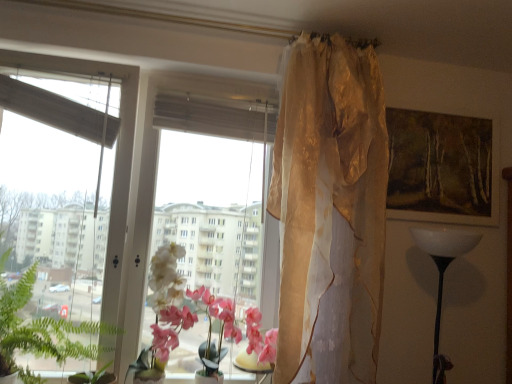
Locate an element on the screen. pink silk orchid at center is located at coordinates (184, 307).

Locate an element on the screen. wooden framed painting at upper right is located at coordinates (440, 168).

Describe the element at coordinates (440, 168) in the screenshot. I see `wooden framed painting at upper right` at that location.

The height and width of the screenshot is (384, 512). What do you see at coordinates (253, 365) in the screenshot? I see `translucent glass table at center` at bounding box center [253, 365].

In order to click on transparent glass window at center in this screenshot , I will do `click(120, 193)`.

Is transparent glass window at center not within translucent glass table at center?

Absolutely, transparent glass window at center is external to translucent glass table at center.

Who is bigger, transparent glass window at center or translucent glass table at center?

transparent glass window at center is bigger.

Which of these two, transparent glass window at center or translucent glass table at center, is wider?

With larger width is translucent glass table at center.

In the image, is transparent glass window at center positioned in front of or behind translucent glass table at center?

Clearly, transparent glass window at center is in front of translucent glass table at center.

Between wooden framed painting at upper right and transparent glass window at center, which one has larger size?

Bigger between the two is transparent glass window at center.

Are wooden framed painting at upper right and transparent glass window at center making contact?

There is a gap between wooden framed painting at upper right and transparent glass window at center.

Does wooden framed painting at upper right turn towards transparent glass window at center?

No, wooden framed painting at upper right does not turn towards transparent glass window at center.

Based on the photo, between wooden framed painting at upper right and transparent glass window at center, which one has larger width?

Wider between the two is transparent glass window at center.

Is translucent glass table at center to the left of translucent gold curtain at upper center from the viewer's perspective?

Yes.

Is translucent glass table at center inside the boundaries of translucent gold curtain at upper center, or outside?

translucent glass table at center exists outside the volume of translucent gold curtain at upper center.

Considering the sizes of objects translucent glass table at center and translucent gold curtain at upper center in the image provided, who is taller, translucent glass table at center or translucent gold curtain at upper center?

Standing taller between the two is translucent gold curtain at upper center.

How different are the orientations of translucent glass table at center and translucent gold curtain at upper center in degrees?

translucent glass table at center and translucent gold curtain at upper center are facing 4.09 degrees away from each other.

From the image's perspective, which is below, wooden framed painting at upper right or green leafy plant at left?

green leafy plant at left is shown below in the image.

Measure the distance from wooden framed painting at upper right to green leafy plant at left.

1.66 meters.

Does wooden framed painting at upper right appear on the right side of green leafy plant at left?

Yes, wooden framed painting at upper right is to the right of green leafy plant at left.

Could you tell me if wooden framed painting at upper right is facing green leafy plant at left?

No.

From a real-world perspective, who is located higher, translucent gold curtain at upper center or green leafy plant at left?

translucent gold curtain at upper center is physically above.

How far apart are translucent gold curtain at upper center and green leafy plant at left?

translucent gold curtain at upper center is 1.05 meters away from green leafy plant at left.

Are translucent gold curtain at upper center and green leafy plant at left far apart?

Indeed, translucent gold curtain at upper center is not near green leafy plant at left.

Who is more distant, translucent gold curtain at upper center or green leafy plant at left?

translucent gold curtain at upper center is behind.

Is translucent glass table at center at the right side of pink silk orchid at center?

Yes.

I want to click on flower above the translucent glass table at center (from the image's perspective), so click(x=184, y=307).

Measure the distance from translucent glass table at center to pink silk orchid at center.

translucent glass table at center and pink silk orchid at center are 25.43 centimeters apart from each other.

Can you confirm if translucent gold curtain at upper center is taller than pink silk orchid at center?

Yes, translucent gold curtain at upper center is taller than pink silk orchid at center.

Is translucent gold curtain at upper center turned away from pink silk orchid at center?

That's not correct — translucent gold curtain at upper center is not looking away from pink silk orchid at center.

From a real-world perspective, between translucent gold curtain at upper center and pink silk orchid at center, who is vertically higher?

translucent gold curtain at upper center.

At what (x,y) coordinates should I click in order to perform the action: click on table below the transparent glass window at center (from the image's perspective). Please return your answer as a coordinate pair (x, y). Image resolution: width=512 pixels, height=384 pixels. Looking at the image, I should click on (253, 365).

Locate an element on the screen. window that appears in front of the wooden framed painting at upper right is located at coordinates (120, 193).

Considering their positions, is wooden framed painting at upper right positioned further to pink silk orchid at center than translucent glass table at center?

The object further to pink silk orchid at center is wooden framed painting at upper right.

Consider the image. Which object lies nearer to the anchor point translucent glass table at center, transparent glass window at center or green leafy plant at left?

The object closer to translucent glass table at center is green leafy plant at left.

When comparing their distances from green leafy plant at left, does pink silk orchid at center or transparent glass window at center seem closer?

transparent glass window at center is positioned closer to the anchor green leafy plant at left.

When comparing their distances from translucent gold curtain at upper center, does translucent glass table at center or transparent glass window at center seem closer?

The object closer to translucent gold curtain at upper center is translucent glass table at center.

Which object lies nearer to the anchor point pink silk orchid at center, transparent glass window at center or wooden framed painting at upper right?

transparent glass window at center lies closer to pink silk orchid at center than the other object.

When comparing their distances from translucent glass table at center, does pink silk orchid at center or transparent glass window at center seem further?

The object further to translucent glass table at center is transparent glass window at center.

Which object lies nearer to the anchor point wooden framed painting at upper right, pink silk orchid at center or translucent glass table at center?

pink silk orchid at center lies closer to wooden framed painting at upper right than the other object.

Which object lies nearer to the anchor point translucent gold curtain at upper center, translucent glass table at center or green leafy plant at left?

translucent glass table at center is closer to translucent gold curtain at upper center.

You are a GUI agent. You are given a task and a screenshot of the screen. Output one action in this format:
    pyautogui.click(x=<x>, y=<y>)
    Task: Click on the curtain between transparent glass window at center and wooden framed painting at upper right in the horizontal direction
    The image size is (512, 384).
    Given the screenshot: What is the action you would take?
    pyautogui.click(x=330, y=212)

The image size is (512, 384). In order to click on table located between pink silk orchid at center and wooden framed painting at upper right in the left-right direction in this screenshot , I will do `click(253, 365)`.

Image resolution: width=512 pixels, height=384 pixels. What are the coordinates of `window situated between green leafy plant at left and pink silk orchid at center from left to right` in the screenshot? It's located at (120, 193).

You are a GUI agent. You are given a task and a screenshot of the screen. Output one action in this format:
    pyautogui.click(x=<x>, y=<y>)
    Task: Click on the window between green leafy plant at left and translucent glass table at center from left to right
    
    Given the screenshot: What is the action you would take?
    pyautogui.click(x=120, y=193)